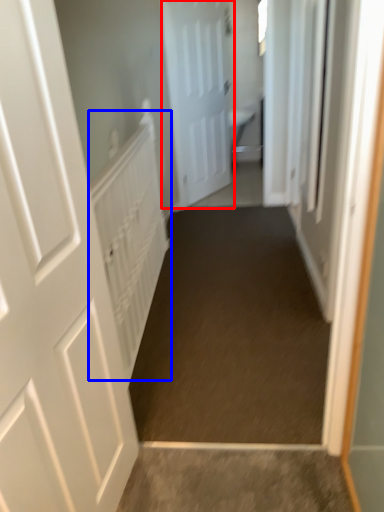
Question: Which object is closer to the camera taking this photo, door (highlighted by a red box) or radiator (highlighted by a blue box)?

Choices:
 (A) door
 (B) radiator

Answer: (B)